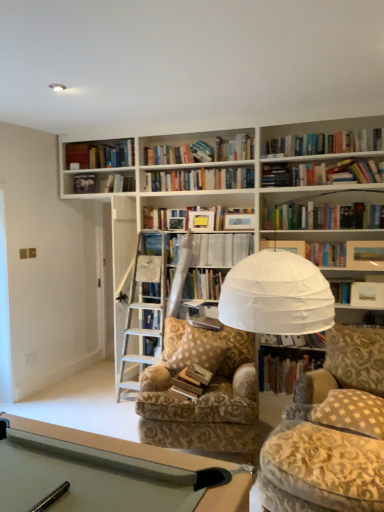
Where is `vacant area on top of velvet-patterned swivel chair at lower right (from a real-world perspective)`? Image resolution: width=384 pixels, height=512 pixels. vacant area on top of velvet-patterned swivel chair at lower right (from a real-world perspective) is located at coordinates (340, 436).